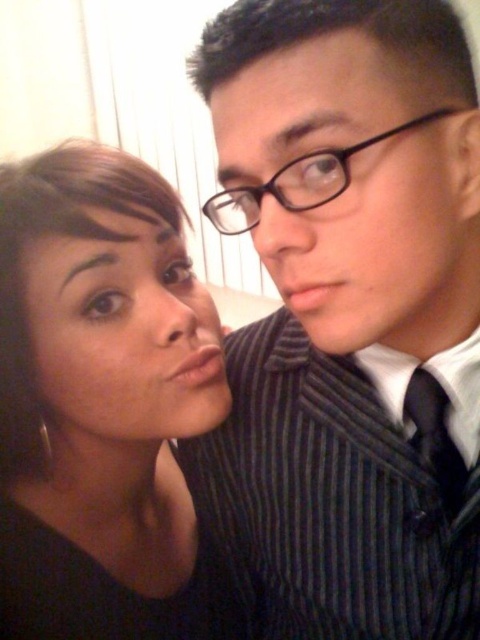
Question: Is black striped suit at center wider than black plastic glasses at upper center?

Choices:
 (A) no
 (B) yes

Answer: (B)

Question: Which object is farther from the camera taking this photo?

Choices:
 (A) black striped suit at center
 (B) black silk tie at right
 (C) striped fabric suit at center

Answer: (B)

Question: Which of the following is the farthest from the observer?

Choices:
 (A) black striped suit at center
 (B) matte black hair at left
 (C) black silk tie at right
 (D) black plastic glasses at upper center

Answer: (C)

Question: Which point is closer to the camera taking this photo?

Choices:
 (A) (337, 184)
 (B) (156, 428)
 (C) (167, 228)
 (D) (223, 177)

Answer: (A)

Question: Is matte black face at lower left positioned at the back of black silk tie at right?

Choices:
 (A) yes
 (B) no

Answer: (B)

Question: Is black plastic glasses at upper center closer to the viewer compared to black silk tie at right?

Choices:
 (A) yes
 (B) no

Answer: (A)